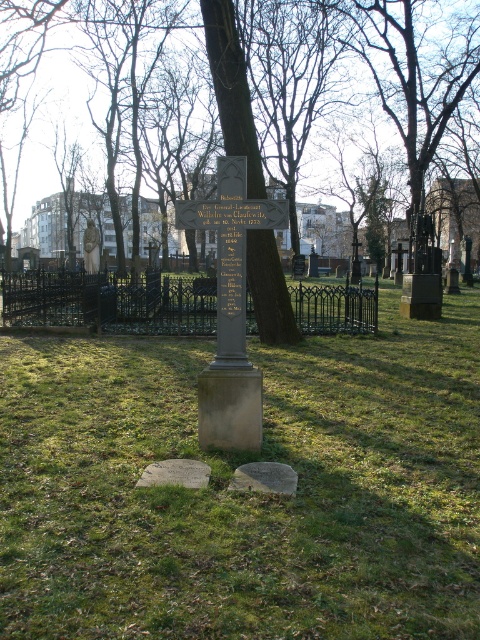
From the picture: You are a gardener who needs to mow the lawn. You see the green grass at center and the bronze statue at left. Which object is shorter and needs to be avoided while mowing?

The green grass at center is shorter than the bronze statue at left, so you should avoid the bronze statue at left while mowing since it is taller and could be damaged by the lawnmower.